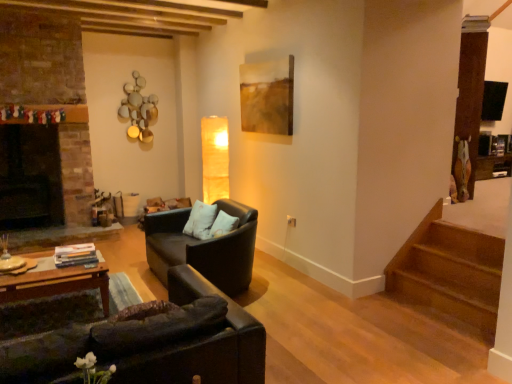
Question: Is black leather couch at lower left, which ranks as the first studio couch in front-to-back order, positioned behind matte brown painting at upper center?

Choices:
 (A) yes
 (B) no

Answer: (B)

Question: Is black leather couch at lower left, which ranks as the first studio couch in front-to-back order, beside matte brown painting at upper center?

Choices:
 (A) yes
 (B) no

Answer: (B)

Question: From a real-world perspective, is black leather couch at lower left, marked as the 2th studio couch in a back-to-front arrangement, on matte brown painting at upper center?

Choices:
 (A) no
 (B) yes

Answer: (A)

Question: Can you confirm if black leather couch at lower left, marked as the 2th studio couch in a back-to-front arrangement, is taller than matte brown painting at upper center?

Choices:
 (A) yes
 (B) no

Answer: (B)

Question: Is black leather couch at lower left, which ranks as the first studio couch in front-to-back order, closer to the viewer compared to matte brown painting at upper center?

Choices:
 (A) yes
 (B) no

Answer: (A)

Question: Considering the relative sizes of black leather couch at lower left, marked as the 2th studio couch in a back-to-front arrangement, and matte brown painting at upper center in the image provided, is black leather couch at lower left, marked as the 2th studio couch in a back-to-front arrangement, bigger than matte brown painting at upper center?

Choices:
 (A) no
 (B) yes

Answer: (B)

Question: Does matte brown painting at upper center have a greater height compared to matte black couch at center, positioned as the 1th studio couch in back-to-front order?

Choices:
 (A) no
 (B) yes

Answer: (B)

Question: Is matte brown painting at upper center touching matte black couch at center, positioned as the 1th studio couch in back-to-front order?

Choices:
 (A) no
 (B) yes

Answer: (A)

Question: Is matte brown painting at upper center further to camera compared to matte black couch at center, positioned as the 1th studio couch in back-to-front order?

Choices:
 (A) no
 (B) yes

Answer: (B)

Question: From the image's perspective, is matte brown painting at upper center located above matte black couch at center, the second studio couch viewed from the front?

Choices:
 (A) yes
 (B) no

Answer: (A)

Question: Is matte brown painting at upper center not inside matte black couch at center, the second studio couch viewed from the front?

Choices:
 (A) no
 (B) yes

Answer: (B)

Question: Does matte brown painting at upper center turn towards matte black couch at center, positioned as the 1th studio couch in back-to-front order?

Choices:
 (A) no
 (B) yes

Answer: (A)

Question: From a real-world perspective, is matte black couch at center, the second studio couch viewed from the front, below black leather couch at lower left, marked as the 2th studio couch in a back-to-front arrangement?

Choices:
 (A) no
 (B) yes

Answer: (B)